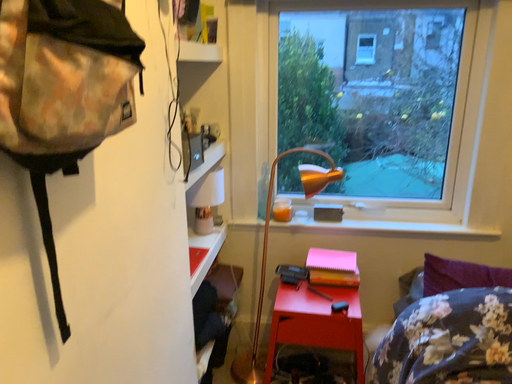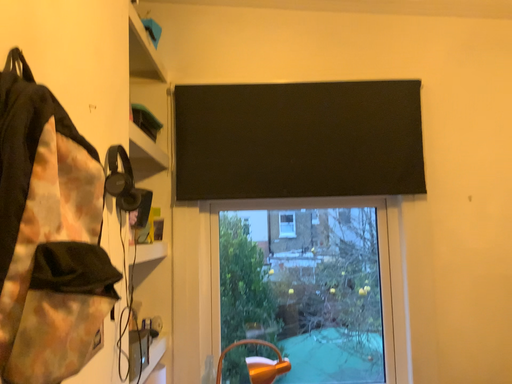
Question: How did the camera likely rotate when shooting the video?

Choices:
 (A) rotated right
 (B) rotated left

Answer: (A)